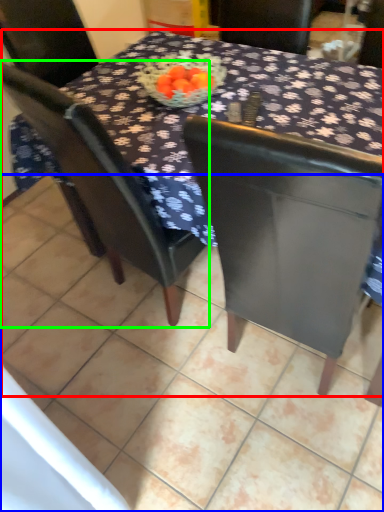
Question: Based on their relative distances, which object is nearer to table (highlighted by a red box)? Choose from tile (highlighted by a blue box) and chair (highlighted by a green box).

Choices:
 (A) tile
 (B) chair

Answer: (B)